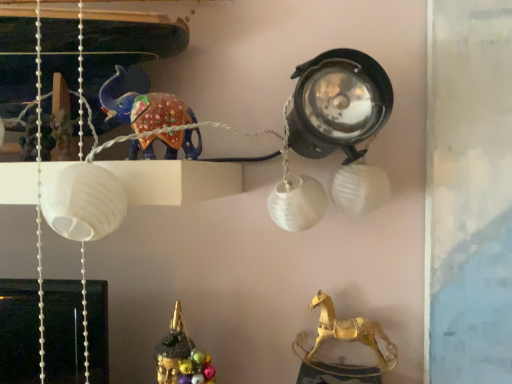
Question: Is shiny blue elephant at upper left, the first animal from the left, taller than gold metallic horse at lower right, which appears as the 2th animal when viewed from the left?

Choices:
 (A) yes
 (B) no

Answer: (B)

Question: Can you confirm if shiny blue elephant at upper left, arranged as the 2th animal when viewed from the right, is positioned to the left of gold metallic horse at lower right, the first animal positioned from the back?

Choices:
 (A) yes
 (B) no

Answer: (A)

Question: Considering the relative positions of shiny blue elephant at upper left, marked as the 1th animal in a top-to-bottom arrangement, and gold metallic horse at lower right, the first animal positioned from the back, in the image provided, is shiny blue elephant at upper left, marked as the 1th animal in a top-to-bottom arrangement, behind gold metallic horse at lower right, the first animal positioned from the back,?

Choices:
 (A) yes
 (B) no

Answer: (B)

Question: From a real-world perspective, does shiny blue elephant at upper left, which is the 2th animal from back to front, stand above gold metallic horse at lower right, placed as the second animal when sorted from front to back?

Choices:
 (A) yes
 (B) no

Answer: (A)

Question: Considering the relative positions of shiny blue elephant at upper left, which is the 2th animal from back to front, and gold metallic horse at lower right, the 1th animal when ordered from right to left, in the image provided, is shiny blue elephant at upper left, which is the 2th animal from back to front, to the right of gold metallic horse at lower right, the 1th animal when ordered from right to left, from the viewer's perspective?

Choices:
 (A) no
 (B) yes

Answer: (A)

Question: Is shiny blue elephant at upper left, arranged as the 2th animal when viewed from the right, facing towards gold metallic horse at lower right, which appears as the 2th animal when viewed from the left?

Choices:
 (A) no
 (B) yes

Answer: (A)

Question: Does gold metallic horse at lower right, placed as the second animal when sorted from front to back, come in front of shiny blue elephant at upper left, the 2th animal ordered from the bottom?

Choices:
 (A) no
 (B) yes

Answer: (A)

Question: From the image's perspective, is gold metallic horse at lower right, which is counted as the 2th animal, starting from the top, under shiny blue elephant at upper left, which appears as the 1th animal when viewed from the front?

Choices:
 (A) no
 (B) yes

Answer: (B)

Question: Is gold metallic horse at lower right, the first animal in the bottom-to-top sequence, wider than shiny blue elephant at upper left, the first animal from the left?

Choices:
 (A) no
 (B) yes

Answer: (A)

Question: From a real-world perspective, is gold metallic horse at lower right, the 1th animal when ordered from right to left, positioned under shiny blue elephant at upper left, the 2th animal ordered from the bottom, based on gravity?

Choices:
 (A) yes
 (B) no

Answer: (A)

Question: Is the depth of gold metallic horse at lower right, the first animal positioned from the back, greater than that of shiny blue elephant at upper left, which appears as the 1th animal when viewed from the front?

Choices:
 (A) yes
 (B) no

Answer: (A)

Question: Is gold metallic horse at lower right, placed as the second animal when sorted from front to back, outside shiny blue elephant at upper left, the first animal from the left?

Choices:
 (A) no
 (B) yes

Answer: (B)

Question: Based on their sizes in the image, would you say shiny blue elephant at upper left, which is the 2th animal from back to front, is bigger or smaller than gold metallic horse at lower right, the first animal in the bottom-to-top sequence?

Choices:
 (A) big
 (B) small

Answer: (A)